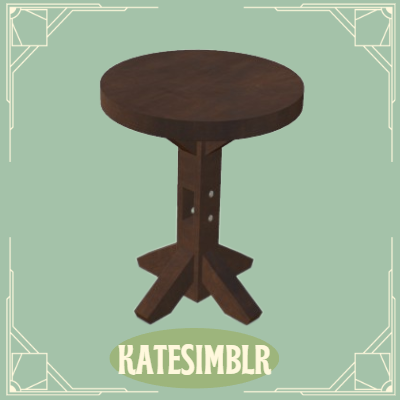
Image resolution: width=400 pixels, height=400 pixels. Identify the location of corner designs. (27, 378), (373, 372), (368, 37), (37, 28).